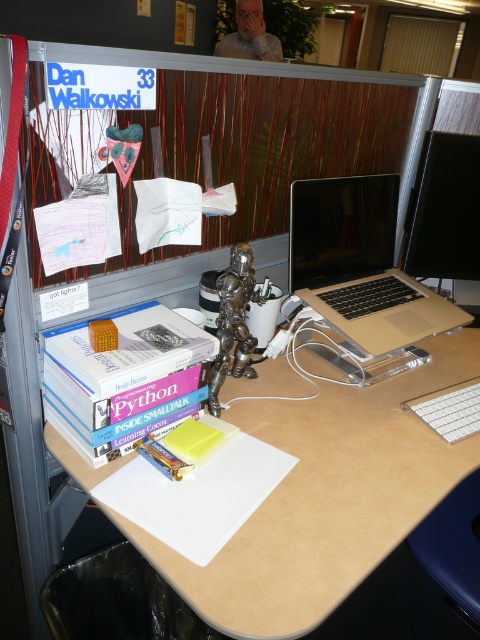
Question: Can you confirm if black glossy monitor at upper right is smaller than white plastic keyboard at lower right?

Choices:
 (A) no
 (B) yes

Answer: (A)

Question: Which of the following is the farthest from the observer?

Choices:
 (A) (317, 225)
 (B) (313, 252)

Answer: (B)

Question: Considering the relative positions of beige wood computer desk at center and black glossy monitor at upper right in the image provided, where is beige wood computer desk at center located with respect to black glossy monitor at upper right?

Choices:
 (A) below
 (B) above

Answer: (A)

Question: Is matte paperback book at center above bronze metallic figurine at center?

Choices:
 (A) no
 (B) yes

Answer: (A)

Question: Which object is the farthest from the gold metallic laptop at upper right?

Choices:
 (A) bronze metallic figurine at center
 (B) satin black laptop at center
 (C) beige wood computer desk at center

Answer: (A)

Question: Which of the following is the farthest from the observer?

Choices:
 (A) white plastic keyboard at lower right
 (B) matte paperback book at center
 (C) beige wood computer desk at center

Answer: (A)